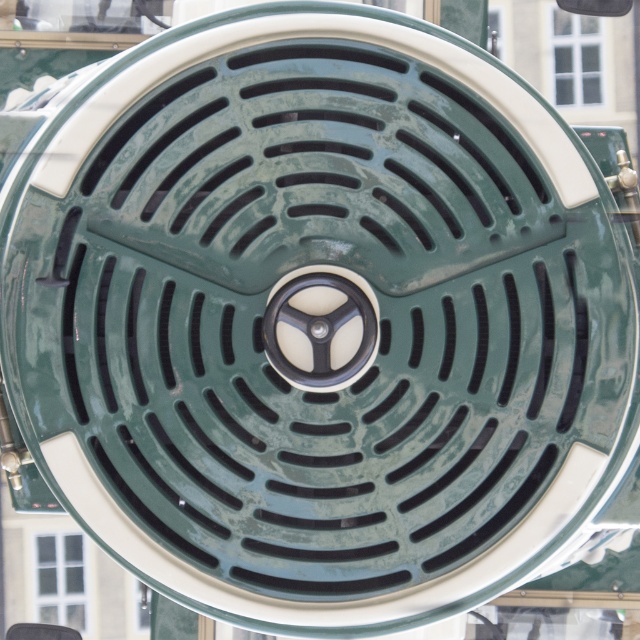
Who is more distant from viewer, [64,538] or [586,20]?

The point [586,20] is more distant.

Image resolution: width=640 pixels, height=640 pixels. Find the location of `transparent glass window at lower left`. transparent glass window at lower left is located at coordinates (60, 579).

Locate an element on the screen. Image resolution: width=640 pixels, height=640 pixels. transparent glass window at lower left is located at coordinates (60, 579).